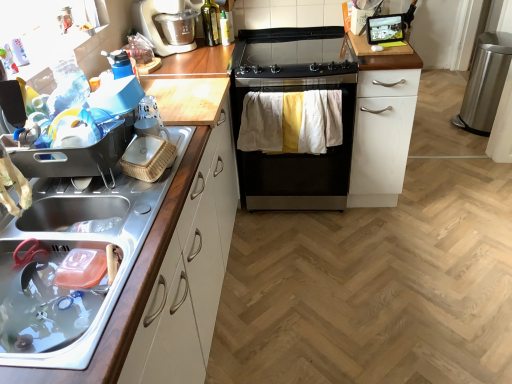
You are a GUI agent. You are given a task and a screenshot of the screen. Output one action in this format:
    pyautogui.click(x=<x>, y=<y>)
    Task: Click on the black stainless steel stove at center
    The image size is (512, 384).
    Given the screenshot: What is the action you would take?
    pyautogui.click(x=291, y=91)

What is the approximate height of metallic sink at left, the first cabinetry viewed from the front?

4.22 inches.

Where is `translucent plastic spray bottle at upper center, the 2th bottle positioned from the left`? translucent plastic spray bottle at upper center, the 2th bottle positioned from the left is located at coordinates (224, 28).

What do you see at coordinates (210, 23) in the screenshot?
I see `green glass bottle at upper center, the 1th bottle viewed from the left` at bounding box center [210, 23].

What are the coordinates of `satin silver coffee machine at upper left` in the screenshot? It's located at (155, 29).

Image resolution: width=512 pixels, height=384 pixels. I want to click on black stainless steel stove at center, so click(x=291, y=91).

Consider the image. From a real-world perspective, between white matte cabinet at center-right, the first cabinetry when ordered from right to left, and satin silver coffee machine at upper left, who is vertically higher?

satin silver coffee machine at upper left is physically above.

Which is correct: white matte cabinet at center-right, the 2th cabinetry from the left, is inside satin silver coffee machine at upper left, or outside of it?

white matte cabinet at center-right, the 2th cabinetry from the left, exists outside the volume of satin silver coffee machine at upper left.

Looking at their sizes, would you say white matte cabinet at center-right, the 2th cabinetry from the left, is wider or thinner than satin silver coffee machine at upper left?

white matte cabinet at center-right, the 2th cabinetry from the left, is wider than satin silver coffee machine at upper left.

Does green glass bottle at upper center, the 1th bottle viewed from the left, have a larger size compared to satin silver coffee machine at upper left?

Actually, green glass bottle at upper center, the 1th bottle viewed from the left, might be smaller than satin silver coffee machine at upper left.

Considering the sizes of green glass bottle at upper center, the 1th bottle viewed from the left, and satin silver coffee machine at upper left in the image, is green glass bottle at upper center, the 1th bottle viewed from the left, taller or shorter than satin silver coffee machine at upper left?

Clearly, green glass bottle at upper center, the 1th bottle viewed from the left, is taller compared to satin silver coffee machine at upper left.

Based on the photo, from the image's perspective, which one is positioned lower, green glass bottle at upper center, the 1th bottle viewed from the left, or satin silver coffee machine at upper left?

satin silver coffee machine at upper left, from the image's perspective.

Is black glass-top gas stove at center further to camera compared to satin silver coffee machine at upper left?

No, black glass-top gas stove at center is closer to the camera.

The height and width of the screenshot is (384, 512). What are the coordinates of `gas stove below the satin silver coffee machine at upper left (from the image's perspective)` in the screenshot? It's located at (289, 52).

How different are the orientations of black glass-top gas stove at center and satin silver coffee machine at upper left in degrees?

The angular difference between black glass-top gas stove at center and satin silver coffee machine at upper left is 90 degrees.

Choose the correct answer: Is black glass-top gas stove at center inside satin silver coffee machine at upper left or outside it?

black glass-top gas stove at center is not inside satin silver coffee machine at upper left, it's outside.

Looking at their sizes, would you say satin silver coffee machine at upper left is wider or thinner than metallic sink at left, the 2th cabinetry when ordered from right to left?

Considering their sizes, satin silver coffee machine at upper left looks slimmer than metallic sink at left, the 2th cabinetry when ordered from right to left.

Which object is more forward, satin silver coffee machine at upper left or metallic sink at left, the first cabinetry viewed from the front?

metallic sink at left, the first cabinetry viewed from the front, is more forward.

What are the coordinates of `coffee machine that appears above the metallic sink at left, the first cabinetry viewed from the front (from the image's perspective)` in the screenshot? It's located at (155, 29).

What's the angular difference between satin silver coffee machine at upper left and metallic sink at left, the 2th cabinetry when ordered from right to left,'s facing directions?

There is a 5.23e-05-degree angle between the facing directions of satin silver coffee machine at upper left and metallic sink at left, the 2th cabinetry when ordered from right to left.

Which is in front, green glass bottle at upper center, the 2th bottle viewed from the right, or black stainless steel stove at center?

black stainless steel stove at center is more forward.

Considering the relative sizes of green glass bottle at upper center, the 2th bottle viewed from the right, and black stainless steel stove at center in the image provided, is green glass bottle at upper center, the 2th bottle viewed from the right, bigger than black stainless steel stove at center?

No, green glass bottle at upper center, the 2th bottle viewed from the right, is not bigger than black stainless steel stove at center.

Is point (214, 2) positioned after point (338, 35)?

Yes.

Is black stainless steel stove at center at the back of green glass bottle at upper center, the 1th bottle viewed from the left?

No, green glass bottle at upper center, the 1th bottle viewed from the left,'s orientation is not away from black stainless steel stove at center.

Is green glass bottle at upper center, the 2th bottle viewed from the right, looking in the opposite direction of metallic sink at left, which appears as the 1th cabinetry when viewed from the left?

That's not correct — green glass bottle at upper center, the 2th bottle viewed from the right, is not looking away from metallic sink at left, which appears as the 1th cabinetry when viewed from the left.

What's the angular difference between green glass bottle at upper center, the 2th bottle viewed from the right, and metallic sink at left, positioned as the second cabinetry in back-to-front order,'s facing directions?

The angular difference between green glass bottle at upper center, the 2th bottle viewed from the right, and metallic sink at left, positioned as the second cabinetry in back-to-front order, is 81.2 degrees.

Is the depth of green glass bottle at upper center, the 1th bottle viewed from the left, greater than that of metallic sink at left, which appears as the 1th cabinetry when viewed from the left?

Yes, it is.

Is there a large distance between green glass bottle at upper center, the 1th bottle viewed from the left, and black glass-top gas stove at center?

green glass bottle at upper center, the 1th bottle viewed from the left, is near black glass-top gas stove at center, not far away.

Is point (212, 12) closer or farther from the camera than point (269, 37)?

Point (212, 12).

Identify the location of gas stove that is on the right side of green glass bottle at upper center, the 2th bottle viewed from the right. (289, 52).

Is green glass bottle at upper center, the 1th bottle viewed from the left, aimed at black glass-top gas stove at center?

No, green glass bottle at upper center, the 1th bottle viewed from the left, does not turn towards black glass-top gas stove at center.

The image size is (512, 384). Find the location of `the 2nd cabinetry located beneath the satin silver coffee machine at upper left (from a real-world perspective)`. the 2nd cabinetry located beneath the satin silver coffee machine at upper left (from a real-world perspective) is located at coordinates (381, 120).

From the image's perspective, which bottle is the 2nd one above the satin silver coffee machine at upper left? Please provide its 2D coordinates.

[(210, 23)]

Looking at the image, which one is located further to metallic sink at left, the 2th cabinetry when ordered from right to left, black glass-top gas stove at center or satin silver coffee machine at upper left?

satin silver coffee machine at upper left is further to metallic sink at left, the 2th cabinetry when ordered from right to left.

Estimate the real-world distances between objects in this image. Which object is further from translucent plastic spray bottle at upper center, the 2th bottle positioned from the left, green glass bottle at upper center, the 2th bottle viewed from the right, or black glass-top gas stove at center?

black glass-top gas stove at center lies further to translucent plastic spray bottle at upper center, the 2th bottle positioned from the left, than the other object.

Considering their positions, is black stainless steel stove at center positioned further to green glass bottle at upper center, the 2th bottle viewed from the right, than black glass-top gas stove at center?

Among the two, black stainless steel stove at center is located further to green glass bottle at upper center, the 2th bottle viewed from the right.

Based on the photo, considering their positions, is metallic sink at left, the first cabinetry viewed from the front, positioned further to translucent plastic spray bottle at upper center, placed as the 1th bottle when sorted from right to left, than green glass bottle at upper center, the 2th bottle viewed from the right?

metallic sink at left, the first cabinetry viewed from the front, is further to translucent plastic spray bottle at upper center, placed as the 1th bottle when sorted from right to left.

Looking at the image, which one is located closer to black stainless steel stove at center, satin silver coffee machine at upper left or white matte cabinet at center-right, the 2th cabinetry in the front-to-back sequence?

white matte cabinet at center-right, the 2th cabinetry in the front-to-back sequence, lies closer to black stainless steel stove at center than the other object.

Based on their spatial positions, is translucent plastic spray bottle at upper center, the 2th bottle positioned from the left, or metallic sink at left, the 2th cabinetry when ordered from right to left, closer to black glass-top gas stove at center?

Based on the image, translucent plastic spray bottle at upper center, the 2th bottle positioned from the left, appears to be nearer to black glass-top gas stove at center.

From the image, which object appears to be nearer to black glass-top gas stove at center, green glass bottle at upper center, the 1th bottle viewed from the left, or translucent plastic spray bottle at upper center, placed as the 1th bottle when sorted from right to left?

translucent plastic spray bottle at upper center, placed as the 1th bottle when sorted from right to left, is closer to black glass-top gas stove at center.

Based on their spatial positions, is translucent plastic spray bottle at upper center, the 2th bottle positioned from the left, or satin silver coffee machine at upper left further from black stainless steel stove at center?

Among the two, satin silver coffee machine at upper left is located further to black stainless steel stove at center.

The height and width of the screenshot is (384, 512). In order to click on gas stove between metallic sink at left, the first cabinetry viewed from the front, and satin silver coffee machine at upper left in the front-back direction in this screenshot , I will do `click(289, 52)`.

This screenshot has height=384, width=512. Identify the location of gas stove between metallic sink at left, positioned as the second cabinetry in back-to-front order, and green glass bottle at upper center, the 2th bottle viewed from the right, from front to back. (289, 52).

Where is `coffee machine between metallic sink at left, the 2th cabinetry when ordered from right to left, and translucent plastic spray bottle at upper center, the 2th bottle positioned from the left, in the front-back direction`? This screenshot has height=384, width=512. coffee machine between metallic sink at left, the 2th cabinetry when ordered from right to left, and translucent plastic spray bottle at upper center, the 2th bottle positioned from the left, in the front-back direction is located at coordinates (155, 29).

The image size is (512, 384). What are the coordinates of `gas stove between green glass bottle at upper center, the 2th bottle viewed from the right, and black stainless steel stove at center in the up-down direction` in the screenshot? It's located at (289, 52).